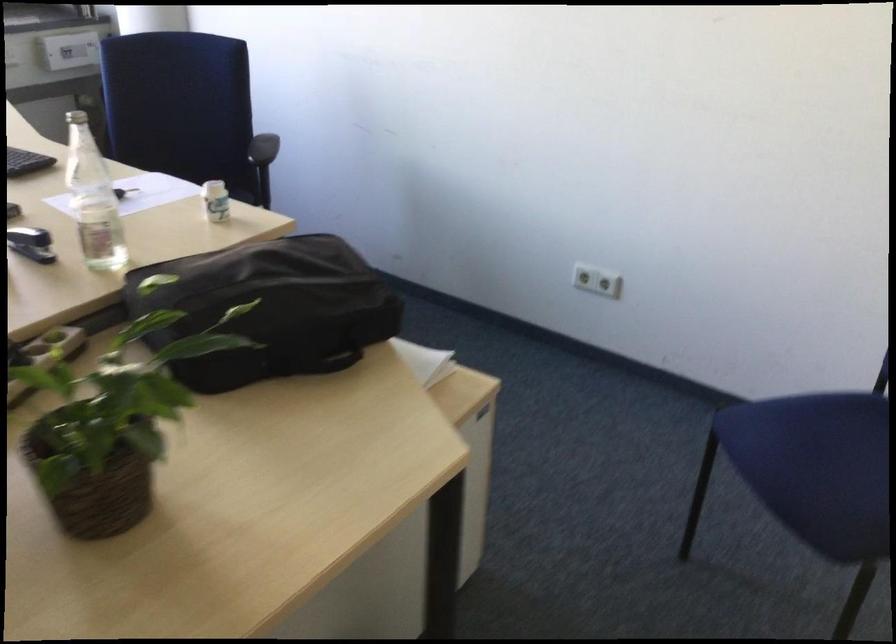
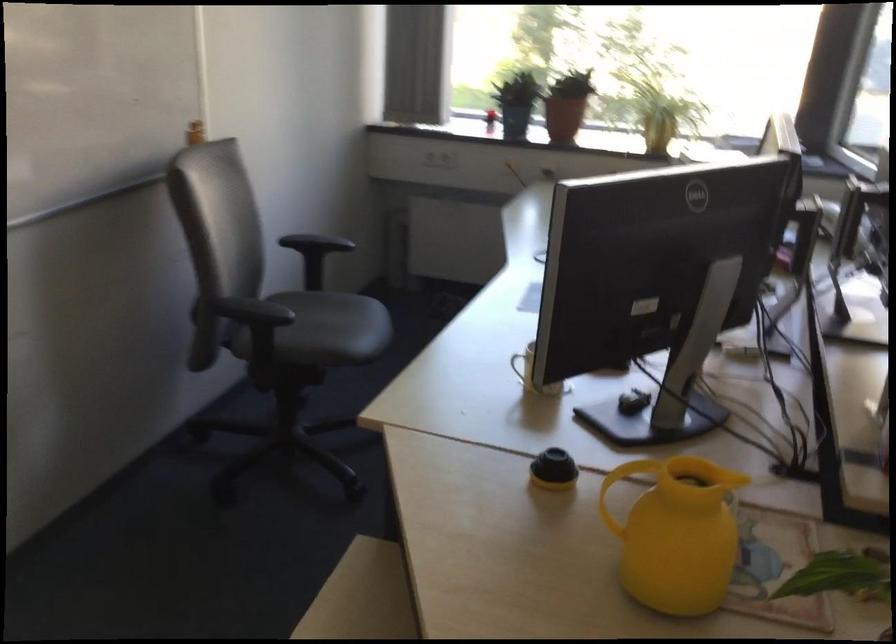
Question: How did the camera likely rotate?

Choices:
 (A) Left
 (B) Right
 (C) Up
 (D) Down

Answer: (A)